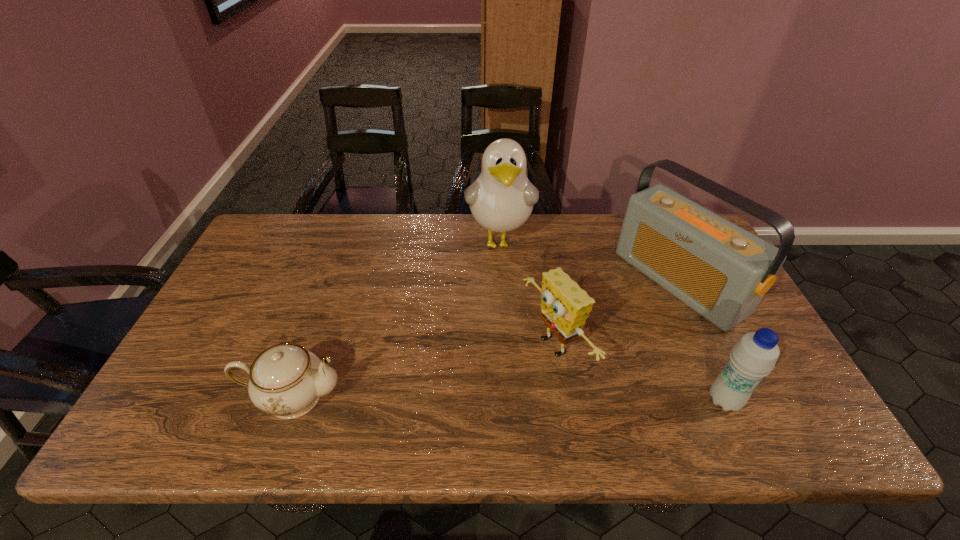
This screenshot has width=960, height=540. I want to click on free space on the desktop that is between the chinaware and the water bottle and is positioned on the front-facing side of the radio receiver, so click(x=480, y=399).

This screenshot has width=960, height=540. What are the coordinates of `free space on the desktop that is between the chinaware and the water bottle and is positioned on the face of the sponge` in the screenshot? It's located at (449, 398).

What are the coordinates of `vacant spot on the desktop that is between the shortest object and the water bottle and is positioned on the beak of the gull` in the screenshot? It's located at (503, 399).